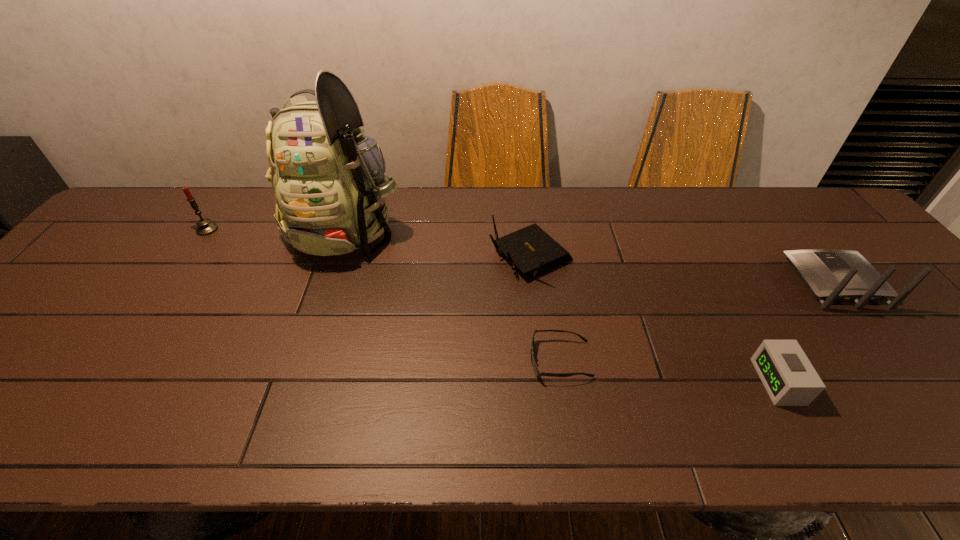
At what (x,y) coordinates should I click in order to perform the action: click on vacant area between the alarm clock and the candle. Please return your answer as a coordinate pair (x, y). Looking at the image, I should click on (492, 306).

Identify the location of the fourth closest object to the shortest object. The image size is (960, 540). (831, 275).

Find the location of a particular element. The image size is (960, 540). object that is the third closest to the alarm clock is located at coordinates (530, 249).

Locate an element on the screen. free spot that satisfies the following two spatial constraints: 1. on the front-facing side of the tallest object; 2. on the left side of the left router is located at coordinates (337, 256).